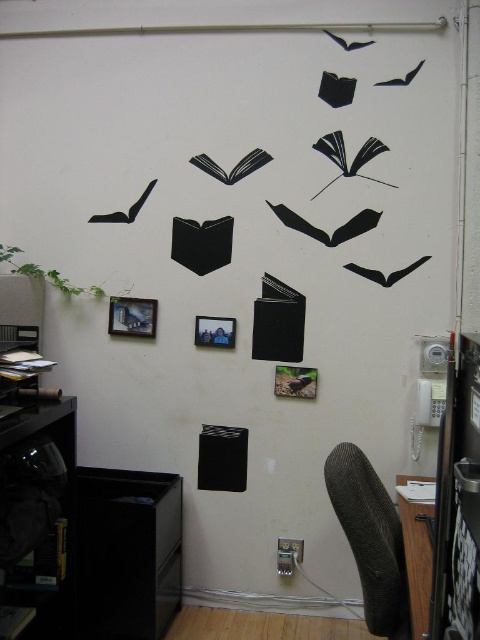
Looking at this image, you are standing in the room and want to sit down. Where is the textured gray chair at lower right located?

The textured gray chair at lower right is located at point 0.842 on the x axis and 0.773 on the y axis.